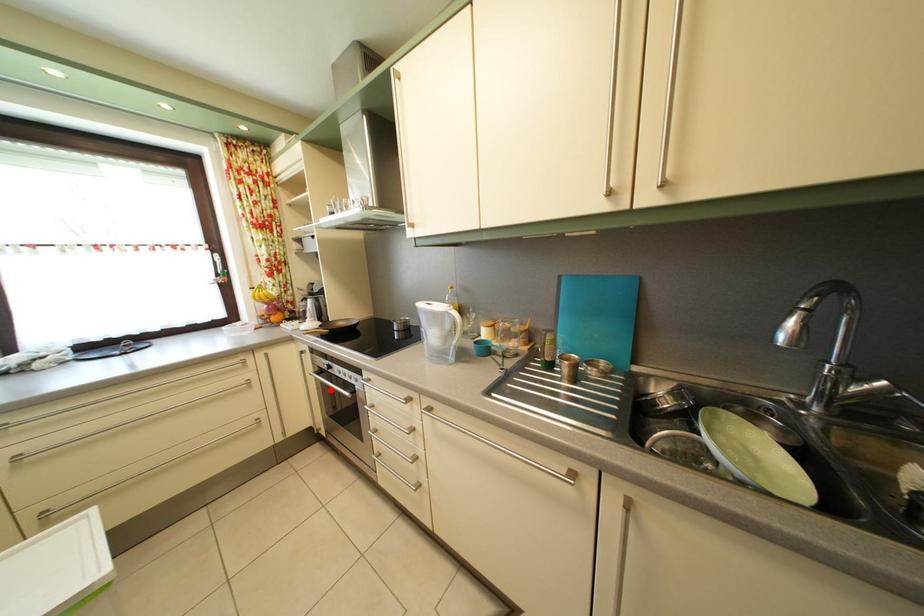
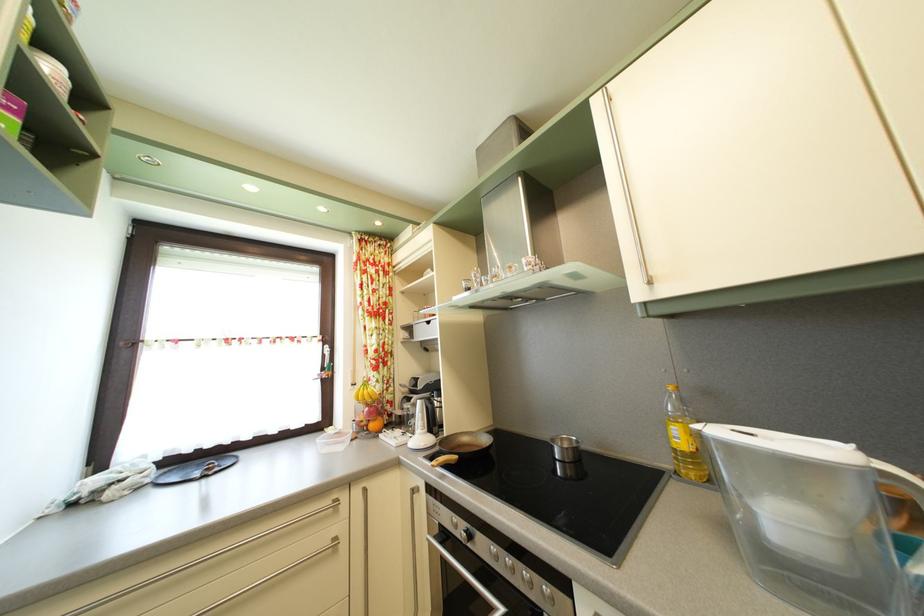
The point at the highlighted location is marked in the first image. Where is the corresponding point in the second image?

(452, 567)